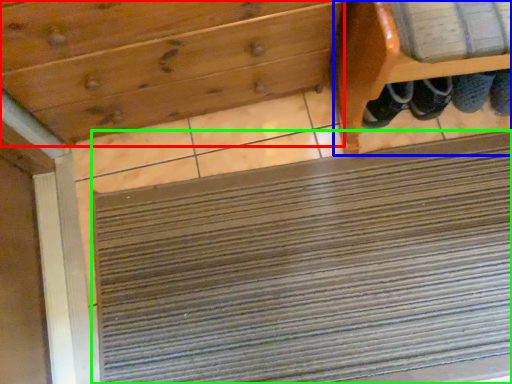
Question: Which object is positioned closest to drawer (highlighted by a red box)? Select from furniture (highlighted by a blue box) and doormat (highlighted by a green box).

Choices:
 (A) furniture
 (B) doormat

Answer: (A)